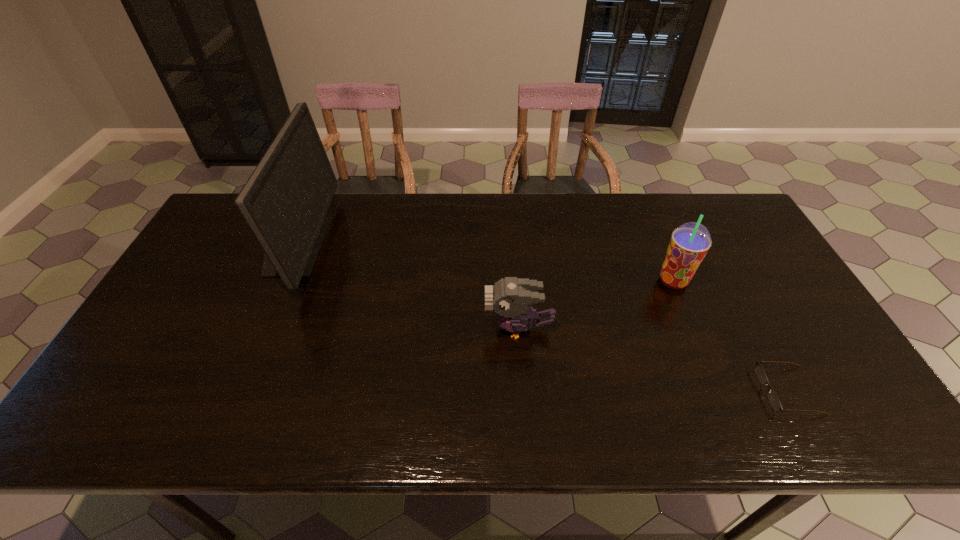
Identify the location of vacant space at the far edge of the desktop. coord(618,217).

Identify the location of blank space at the near edge of the desktop. This screenshot has height=540, width=960. (253, 428).

This screenshot has width=960, height=540. In the image, there is a desktop. Find the location of `free region at the left edge`. free region at the left edge is located at coordinates (187, 313).

In order to click on free space at the right edge of the desktop in this screenshot , I will do `click(795, 346)`.

In the image, there is a desktop. In order to click on vacant space at the near left corner in this screenshot , I will do `click(94, 433)`.

Locate an element on the screen. Image resolution: width=960 pixels, height=540 pixels. vacant space at the far right corner is located at coordinates (748, 226).

Find the location of a particular element. free spot between the nearest object and the third farthest object is located at coordinates (654, 360).

Where is `unoccupied position between the third object from left to right and the third object from right to left`? unoccupied position between the third object from left to right and the third object from right to left is located at coordinates (596, 305).

Locate an element on the screen. free space between the bird and the spectacles is located at coordinates (654, 360).

Find the location of a particular element. The height and width of the screenshot is (540, 960). vacant space that's between the third farthest object and the leftmost object is located at coordinates (407, 286).